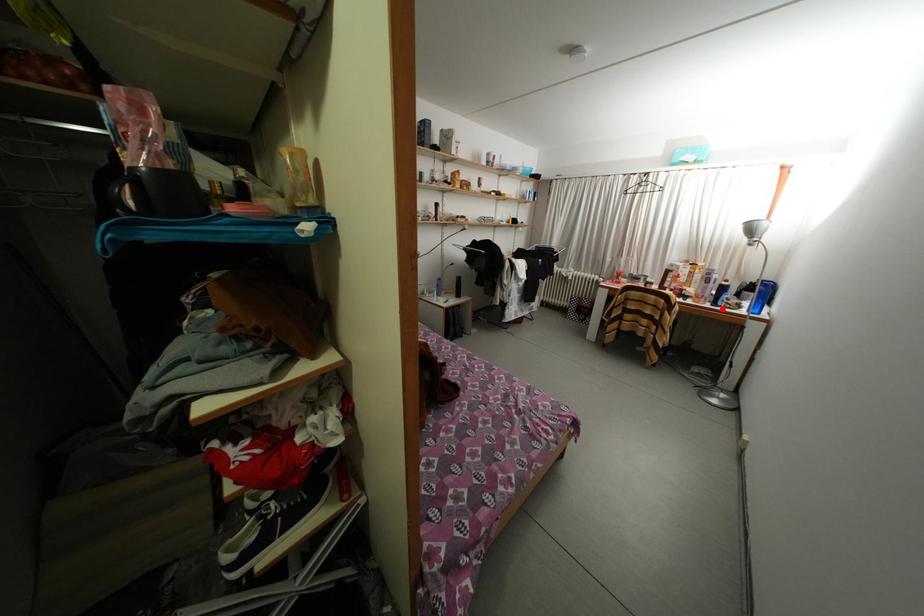
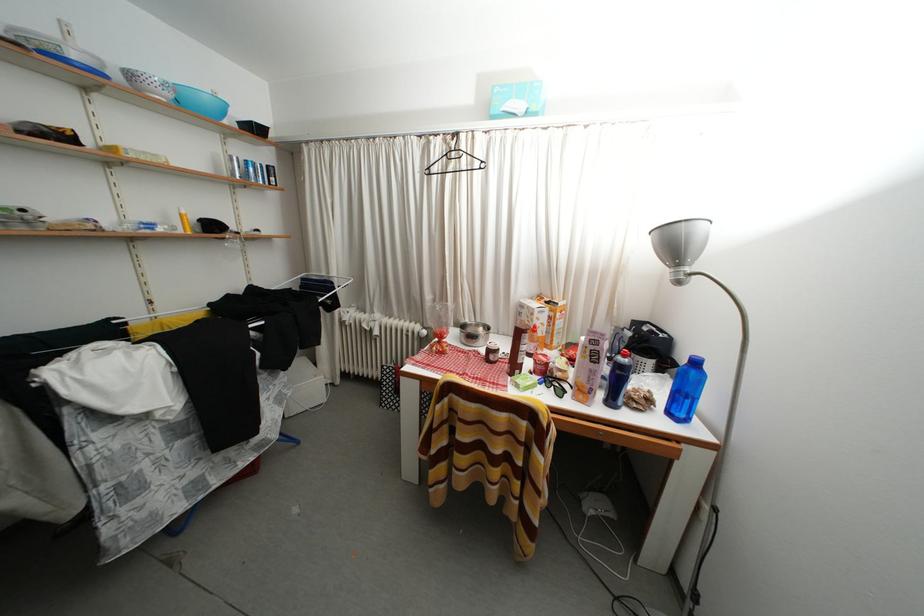
In the second image, find the point that corresponds to the highlighted location in the first image.

(618, 408)